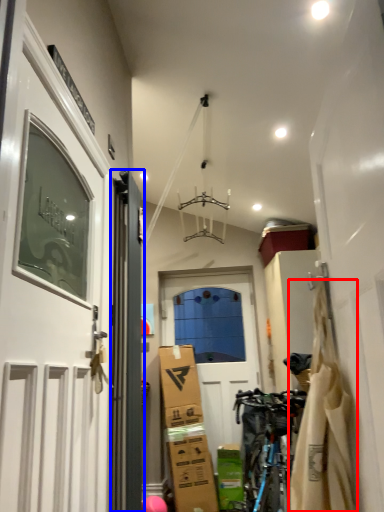
Question: Which object is further to the camera taking this photo, material (highlighted by a red box) or door (highlighted by a blue box)?

Choices:
 (A) material
 (B) door

Answer: (B)